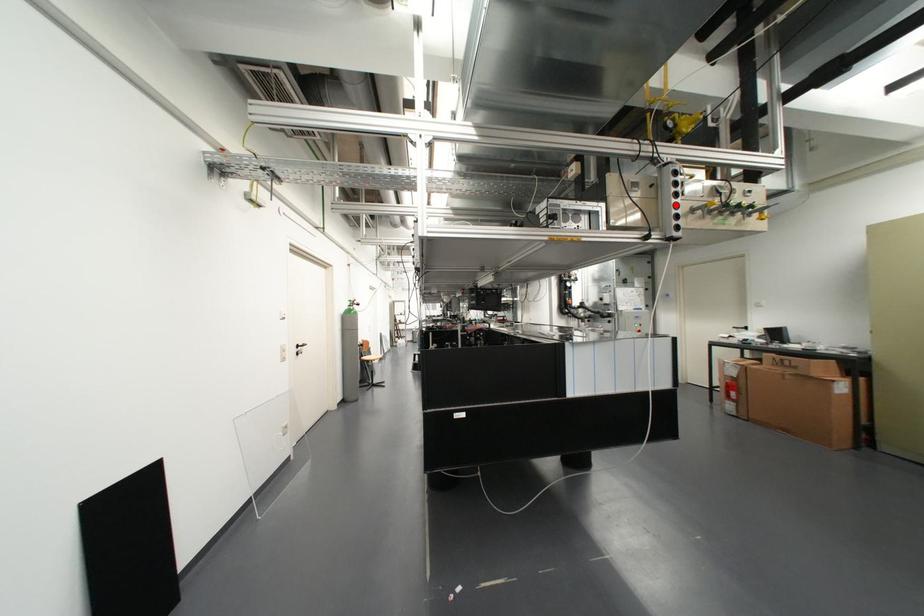
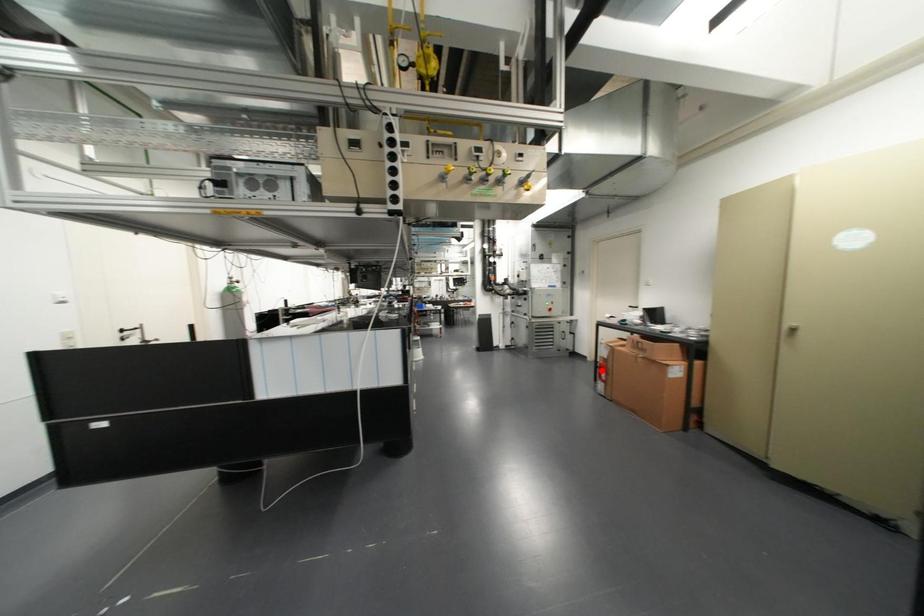
I am providing you with two images of the same scene from different viewpoints. A red point is marked on the first image and another point is marked on the second image. Do the highlighted points in image1 and image2 indicate the same real-world spot?

No